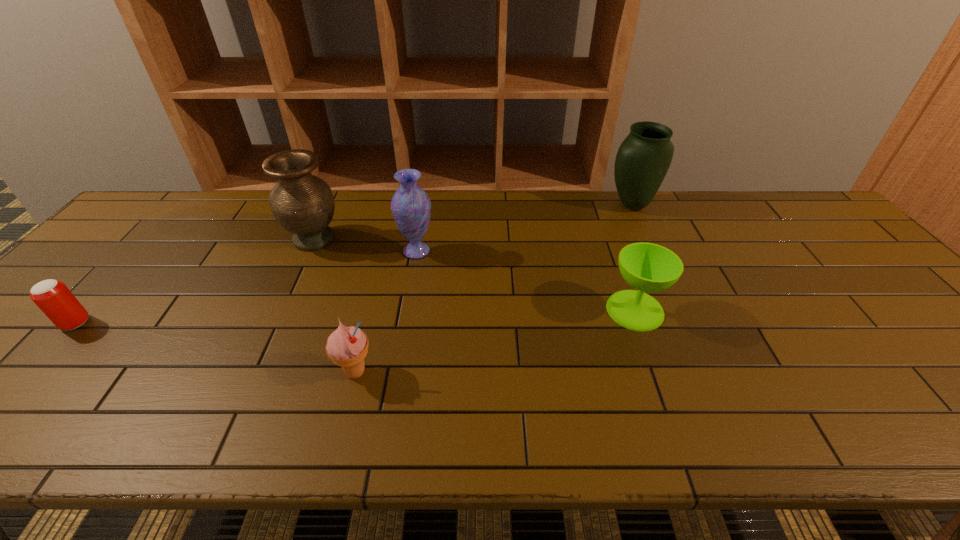
I want to click on free space that is in between the second vase from right to left and the shortest object, so tap(246, 287).

Find the location of `free point between the leftmost vase and the farthest vase`. free point between the leftmost vase and the farthest vase is located at coordinates (473, 222).

Identify the location of vacant area that lies between the second vase from left to right and the fifth object from right to left. (365, 245).

The height and width of the screenshot is (540, 960). I want to click on vacant space that's between the second vase from right to left and the shortest object, so click(246, 287).

Identify the location of vacant area that lies between the second object from left to right and the leftmost object. The width and height of the screenshot is (960, 540). (195, 281).

Locate an element on the screen. Image resolution: width=960 pixels, height=540 pixels. vacant space that is in between the second vase from right to left and the leftmost object is located at coordinates (246, 287).

Image resolution: width=960 pixels, height=540 pixels. I want to click on vacant area between the wineglass and the leftmost vase, so click(x=474, y=275).

I want to click on object that is the closest to the leftmost vase, so click(411, 207).

Identify which object is the nearest to the wineglass. Please provide its 2D coordinates. Your answer should be formatted as a tuple, i.e. [(x, y)], where the tuple contains the x and y coordinates of a point satisfying the conditions above.

[(644, 157)]

Identify which vase is the second closest to the second vase from left to right. Please provide its 2D coordinates. Your answer should be formatted as a tuple, i.e. [(x, y)], where the tuple contains the x and y coordinates of a point satisfying the conditions above.

[(644, 157)]